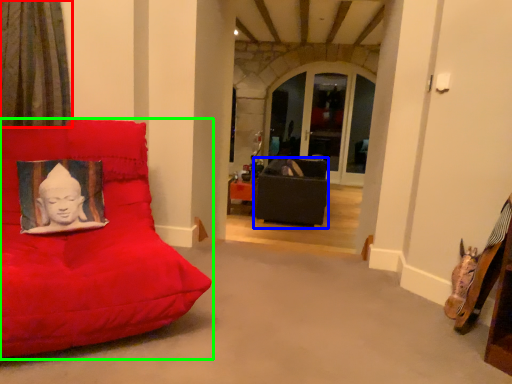
Question: Considering the real-world distances, which object is closest to curtain (highlighted by a red box)? furniture (highlighted by a blue box) or furniture (highlighted by a green box).

Choices:
 (A) furniture
 (B) furniture

Answer: (B)